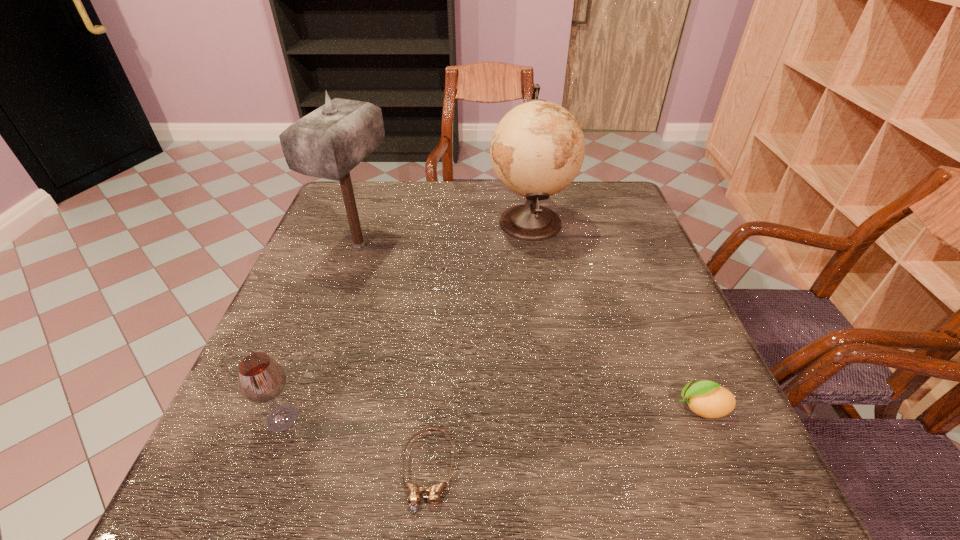
Where is `vacant area that lies between the wineglass and the lemon`? vacant area that lies between the wineglass and the lemon is located at coordinates [492, 413].

At what (x,y) coordinates should I click in order to perform the action: click on object that is the second closest to the second object from right to left. Please return your answer as a coordinate pair (x, y). Looking at the image, I should click on (708, 399).

Select which object appears as the second closest to the third object from right to left. Please provide its 2D coordinates. Your answer should be formatted as a tuple, i.e. [(x, y)], where the tuple contains the x and y coordinates of a point satisfying the conditions above.

[(708, 399)]

Find the location of a particular element. blank area in the image that satisfies the following two spatial constraints: 1. on the front-facing side of the fourth shortest object; 2. on the front lenses and sides of the goggles is located at coordinates (568, 471).

You are a GUI agent. You are given a task and a screenshot of the screen. Output one action in this format:
    pyautogui.click(x=<x>, y=<y>)
    Task: Click on the vacant space that satisfies the following two spatial constraints: 1. on the back side of the wineglass; 2. on the right side of the mallet
    This screenshot has height=540, width=960.
    Given the screenshot: What is the action you would take?
    pyautogui.click(x=348, y=245)

Find the location of `free spot that satisfies the following two spatial constraints: 1. with leaves positioned above the rightmost object; 2. on the front side of the wineglass`. free spot that satisfies the following two spatial constraints: 1. with leaves positioned above the rightmost object; 2. on the front side of the wineglass is located at coordinates (x=706, y=418).